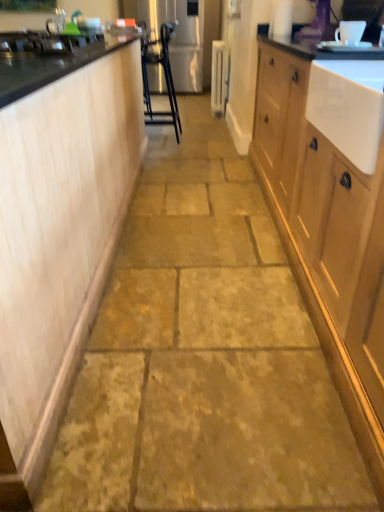
Question: In the image, is silver metallic faucet at upper left on the left side or the right side of light wood cabinetry at left, the 2th cabinetry when ordered from right to left?

Choices:
 (A) right
 (B) left

Answer: (B)

Question: Looking at their shapes, would you say silver metallic faucet at upper left is wider or thinner than light wood cabinetry at left, the first cabinetry when ordered from left to right?

Choices:
 (A) thin
 (B) wide

Answer: (A)

Question: Considering the real-world distances, which object is farthest from the wooden cabinet at right, which is the first cabinetry from right to left?

Choices:
 (A) light wood cabinetry at left, the first cabinetry when ordered from left to right
 (B) white ceramic mug at upper center, the second appliance in the left-to-right sequence
 (C) white painted radiator at center, arranged as the 2th appliance when viewed from the right
 (D) metallic silver bar stool at center
 (E) natural stone floor at center

Answer: (C)

Question: Estimate the real-world distances between objects in this image. Which object is closer to the light wood cabinetry at left, the 2th cabinetry when ordered from right to left?

Choices:
 (A) metallic silver bar stool at center
 (B) white ceramic mug at upper center, placed as the 2th appliance when sorted from back to front
 (C) white painted radiator at center, the first appliance in the left-to-right sequence
 (D) wooden cabinet at right, which is counted as the 2th cabinetry, starting from the left
 (E) silver metallic faucet at upper left

Answer: (D)